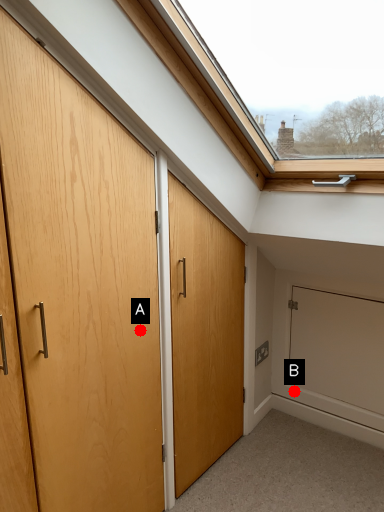
Question: Two points are circled on the image, labeled by A and B beside each circle. Which point is closer to the camera taking this photo?

Choices:
 (A) A is closer
 (B) B is closer

Answer: (A)